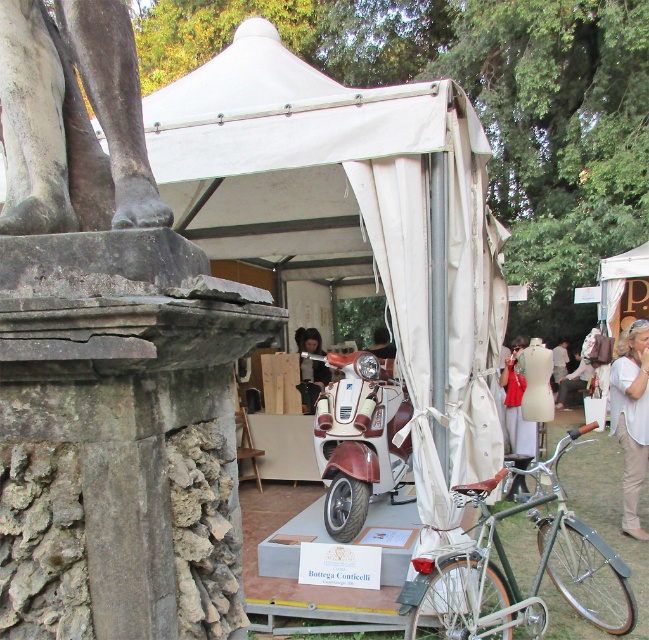
Question: Is dark brown leather jacket at center to the left of white cotton dress at center from the viewer's perspective?

Choices:
 (A) no
 (B) yes

Answer: (B)

Question: Can you confirm if gray stone statue at upper left is positioned to the left of white cotton dress at center?

Choices:
 (A) yes
 (B) no

Answer: (A)

Question: Which point is closer to the camera?

Choices:
 (A) white cotton dress at center
 (B) white canvas tent at center
 (C) gray stone statue at upper left
 (D) green metallic bicycle at lower right

Answer: (C)

Question: Which point is farther from the camera taking this photo?

Choices:
 (A) (589, 531)
 (B) (463, 460)

Answer: (B)

Question: Which point is closer to the camera taking this photo?

Choices:
 (A) (363, 250)
 (B) (639, 442)

Answer: (B)

Question: Does green metallic bicycle at lower right have a larger size compared to red fabric dress at lower right?

Choices:
 (A) yes
 (B) no

Answer: (A)